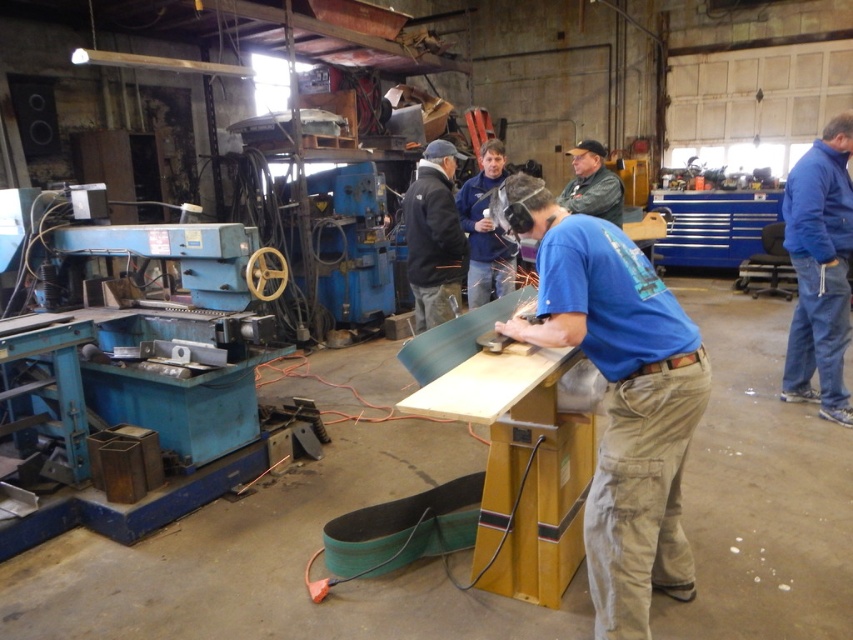
Question: Which object is the farthest from the blue fleece jacket at right?

Choices:
 (A) gray fabric jacket at upper center
 (B) blue cotton shirt at center
 (C) metallic gray grinding wheel at center
 (D) blue shirt at center

Answer: (B)

Question: Can you confirm if dark blue jacket at center is positioned below gray fabric jacket at upper center?

Choices:
 (A) no
 (B) yes

Answer: (B)

Question: Which of the following is the farthest from the observer?

Choices:
 (A) (502, 346)
 (B) (486, 259)
 (C) (576, 198)
 (D) (834, 145)

Answer: (B)

Question: Does blue cotton shirt at center have a larger size compared to metallic gray grinding wheel at center?

Choices:
 (A) no
 (B) yes

Answer: (B)

Question: Among these objects, which one is nearest to the camera?

Choices:
 (A) dark blue jacket at center
 (B) gray fabric jacket at upper center
 (C) blue shirt at center
 (D) blue cotton shirt at center

Answer: (D)

Question: Does blue fleece jacket at right have a larger size compared to metallic gray grinding wheel at center?

Choices:
 (A) yes
 (B) no

Answer: (A)